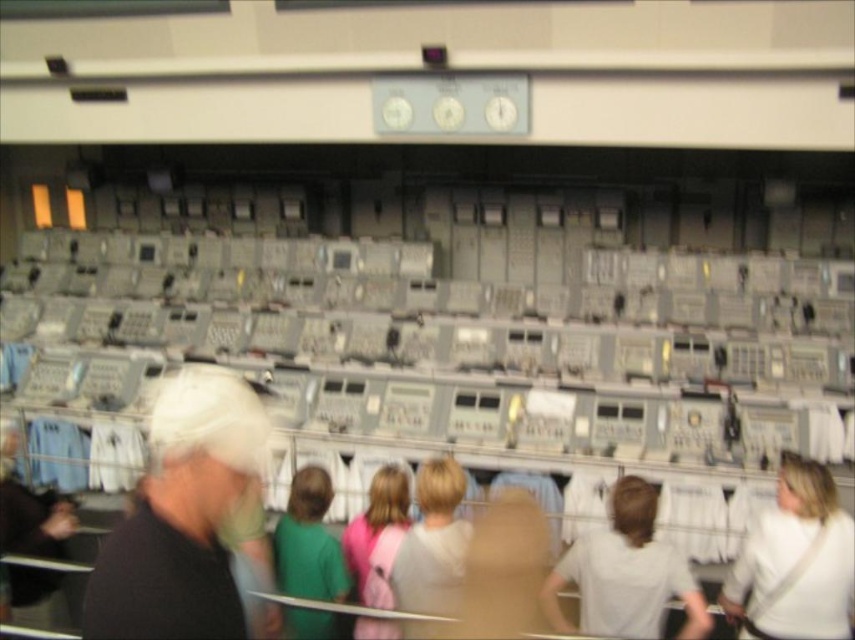
Question: Estimate the real-world distances between objects in this image. Which object is farther from the beige fabric shirt at center?

Choices:
 (A) white matte shirt at center
 (B) green matte shirt at center
 (C) light gray sweater at center
 (D) pink fabric at center

Answer: (B)

Question: Which of the following is the closest to the observer?

Choices:
 (A) (425, 586)
 (B) (476, 592)
 (C) (830, 547)

Answer: (A)

Question: Observing the image, what is the correct spatial positioning of white matte cap at upper left in reference to light gray sweater at center?

Choices:
 (A) right
 (B) left

Answer: (B)

Question: In this image, where is white matte cap at upper left located relative to green matte shirt at center?

Choices:
 (A) right
 (B) left

Answer: (B)

Question: Which of the following is the farthest from the observer?

Choices:
 (A) (333, 536)
 (B) (476, 630)

Answer: (A)

Question: Does white fabric bag at lower right appear under beige fabric shirt at center?

Choices:
 (A) no
 (B) yes

Answer: (A)